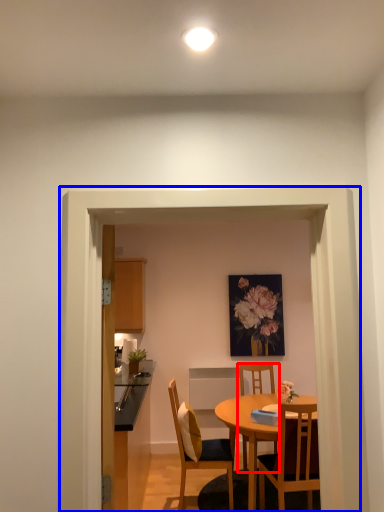
Question: Which point is further to the camera, chair (highlighted by a red box) or glass door (highlighted by a blue box)?

Choices:
 (A) chair
 (B) glass door

Answer: (A)